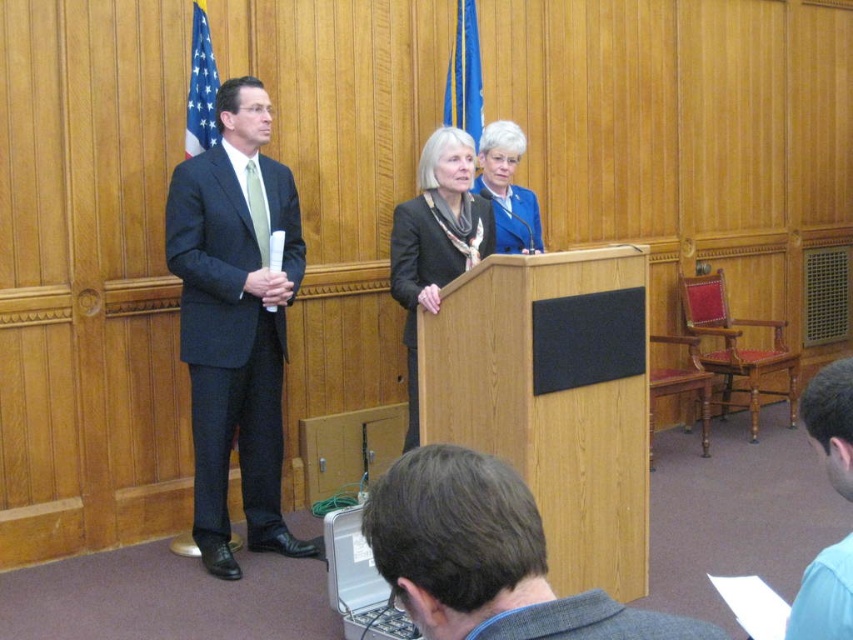
You are standing in the room and want to place a small plant between the two points, point (834, 413) and point (495, 180). Which point should the plant be closer to in order to be equidistant from both points?

The plant should be placed closer to point (495, 180) because point (834, 413) is closer to the viewer than point (495, 180).